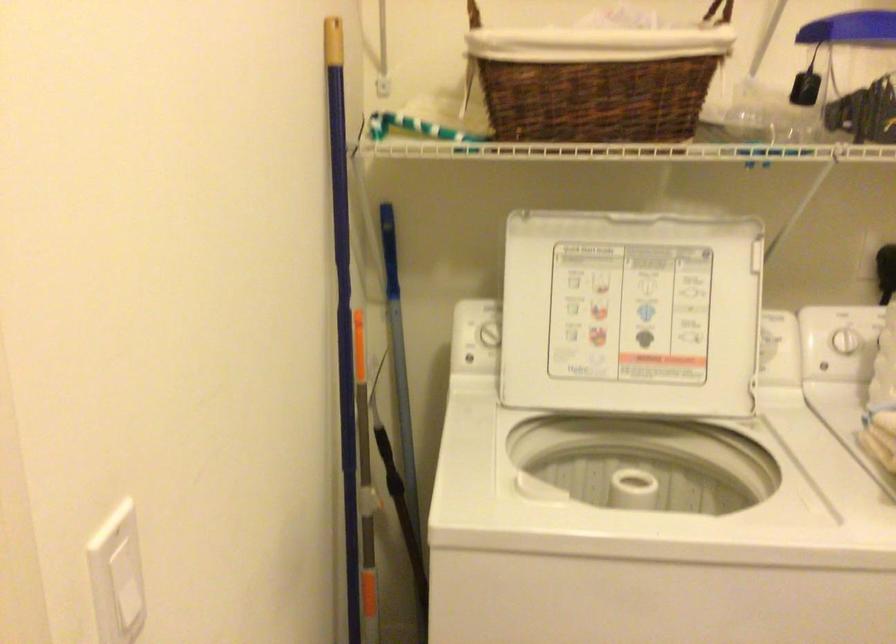
The height and width of the screenshot is (644, 896). In order to click on washing machine lid in this screenshot , I will do `click(631, 313)`.